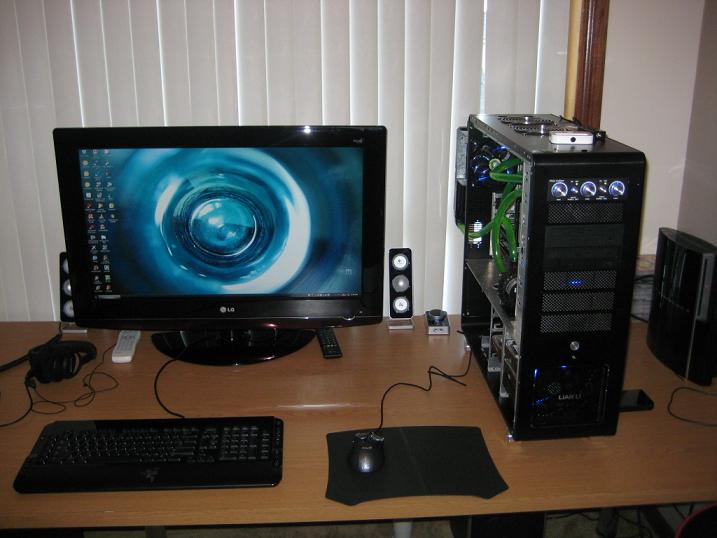
This screenshot has width=717, height=538. In order to click on speakers in this screenshot , I will do `click(399, 293)`, `click(67, 295)`.